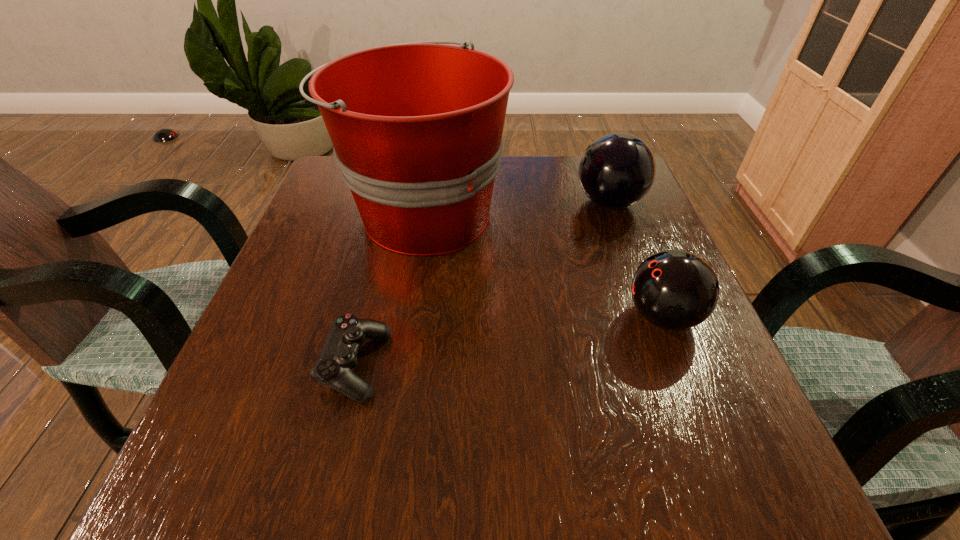
You are a GUI agent. You are given a task and a screenshot of the screen. Output one action in this format:
    pyautogui.click(x=<x>, y=<y>)
    Task: Click on the vacant point at the far edge
    The image size is (960, 540).
    Given the screenshot: What is the action you would take?
    pyautogui.click(x=533, y=183)

Image resolution: width=960 pixels, height=540 pixels. What are the coordinates of `vacant space at the near edge of the desktop` in the screenshot? It's located at (439, 500).

Locate an element on the screen. The image size is (960, 540). vacant region at the left edge of the desktop is located at coordinates click(x=293, y=238).

Identify the location of free space at the right edge. This screenshot has height=540, width=960. (735, 390).

Find the location of `vacant space at the far left corner`. vacant space at the far left corner is located at coordinates (319, 205).

Where is `vacant space at the near right corner`? vacant space at the near right corner is located at coordinates (693, 468).

The height and width of the screenshot is (540, 960). Identify the location of free space between the tallest object and the second shortest object. (543, 265).

At what (x,y) coordinates should I click in order to perform the action: click on free area in between the second tallest object and the control. Please return your answer as a coordinate pair (x, y). The width and height of the screenshot is (960, 540). Looking at the image, I should click on (482, 284).

Identify the location of empty space between the farther bowling ball and the shortest object. The image size is (960, 540). (x=482, y=284).

Identify the location of free spot between the nearer bowling ball and the tallest object. (543, 265).